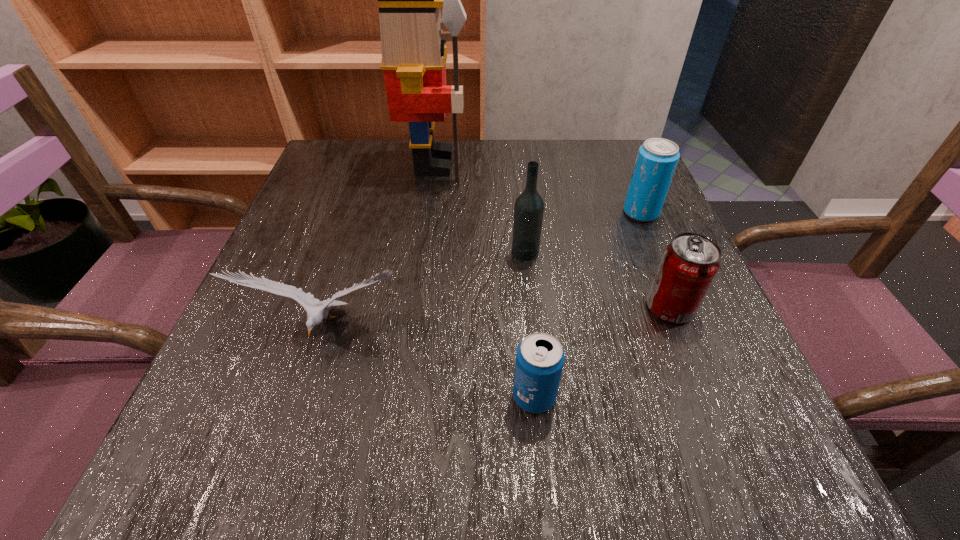
Find the location of a particular element. The image size is (960, 540). free space at the right edge is located at coordinates click(x=636, y=366).

At what (x,y) coordinates should I click in order to perform the action: click on free point at the far left corner. Please return your answer as a coordinate pair (x, y). Looking at the image, I should click on (384, 165).

The height and width of the screenshot is (540, 960). What are the coordinates of `vacant position at the far right corner of the desktop` in the screenshot? It's located at (624, 141).

Where is `vacant space at the near right corner of the desktop`? vacant space at the near right corner of the desktop is located at coordinates (738, 482).

You are a GUI agent. You are given a task and a screenshot of the screen. Output one action in this format:
    pyautogui.click(x=<x>, y=<y>)
    Task: Click on the unoccupied area between the gull and the tallest object
    This screenshot has width=960, height=540.
    Given the screenshot: What is the action you would take?
    pyautogui.click(x=380, y=247)

Where is `vacant area that lies between the nutcracker and the nearest object`? Image resolution: width=960 pixels, height=540 pixels. vacant area that lies between the nutcracker and the nearest object is located at coordinates (484, 280).

In order to click on free spot between the fifth shortest object and the second farthest soda can in this screenshot , I will do `click(597, 280)`.

The height and width of the screenshot is (540, 960). I want to click on blank region between the fifth nearest object and the gull, so click(x=484, y=271).

Identify the location of free area in between the gull and the second farthest soda can. The image size is (960, 540). (498, 319).

Locate an element on the screen. Image resolution: width=960 pixels, height=540 pixels. vacant area between the shortest soda can and the second farthest soda can is located at coordinates (602, 352).